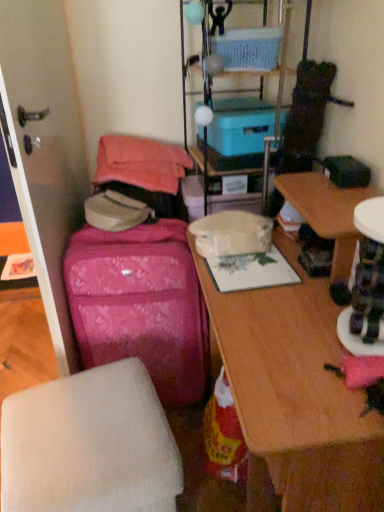
Question: Looking at the image, does white matte ottoman at lower left seem bigger or smaller compared to wooden desk at center?

Choices:
 (A) small
 (B) big

Answer: (A)

Question: From the image's perspective, is white matte ottoman at lower left positioned above or below wooden desk at center?

Choices:
 (A) below
 (B) above

Answer: (A)

Question: Which object is the farthest from the blue cardboard box at upper center, marked as the 1th storage box in a top-to-bottom arrangement?

Choices:
 (A) transparent plastic screen door at left
 (B) pink fabric suitcase at left
 (C) white matte ottoman at lower left
 (D) blue plastic storage box at center, which ranks as the 1th storage box in bottom-to-top order
 (E) wooden desk at center

Answer: (C)

Question: Estimate the real-world distances between objects in this image. Which object is farther from the pink fabric suitcase at left?

Choices:
 (A) blue plastic storage at upper center
 (B) blue plastic storage box at center, which ranks as the 1th storage box in bottom-to-top order
 (C) blue cardboard box at upper center, marked as the 1th storage box in a top-to-bottom arrangement
 (D) transparent plastic screen door at left
 (E) white matte ottoman at lower left

Answer: (C)